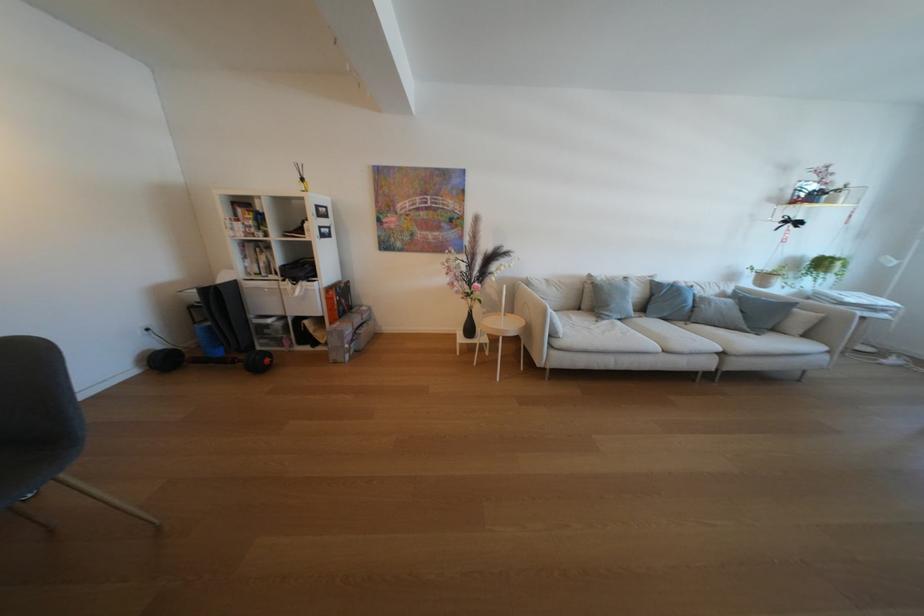
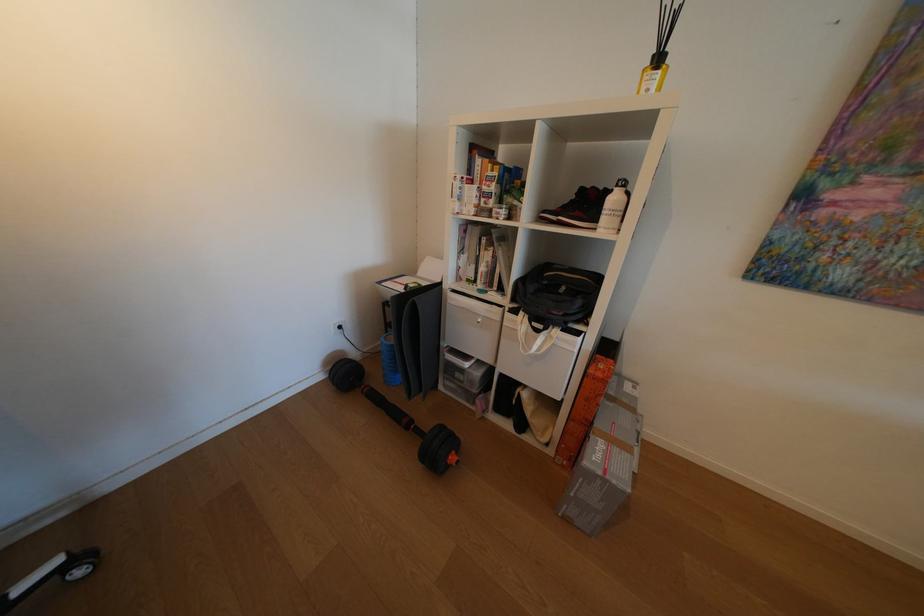
Locate, in the second image, the point that corresponds to [298,285] in the first image.

(531, 325)